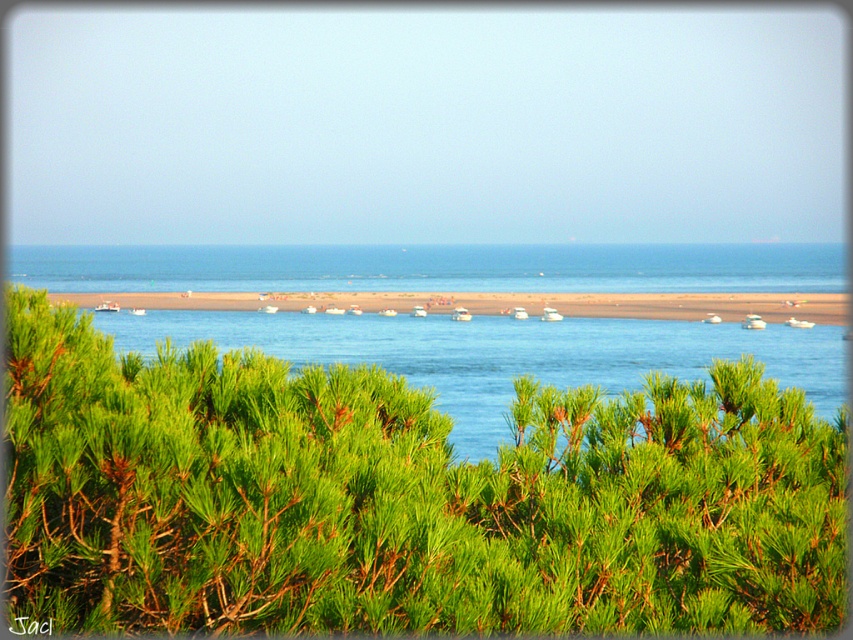
Question: Is green leafy bush at center closer to camera compared to brown sand at center?

Choices:
 (A) yes
 (B) no

Answer: (A)

Question: Does green leafy bush at center have a lesser width compared to blue water at center?

Choices:
 (A) yes
 (B) no

Answer: (A)

Question: Among these objects, which one is nearest to the camera?

Choices:
 (A) blue water at center
 (B) green leafy bush at center

Answer: (B)

Question: Is blue water at center to the right of brown sand at center from the viewer's perspective?

Choices:
 (A) yes
 (B) no

Answer: (A)

Question: Based on their relative distances, which object is farther from the brown sand at center?

Choices:
 (A) green leafy bush at center
 (B) blue water at center

Answer: (A)

Question: Which point is farther from the camera taking this photo?

Choices:
 (A) (363, 353)
 (B) (508, 449)
 (C) (701, 305)

Answer: (C)